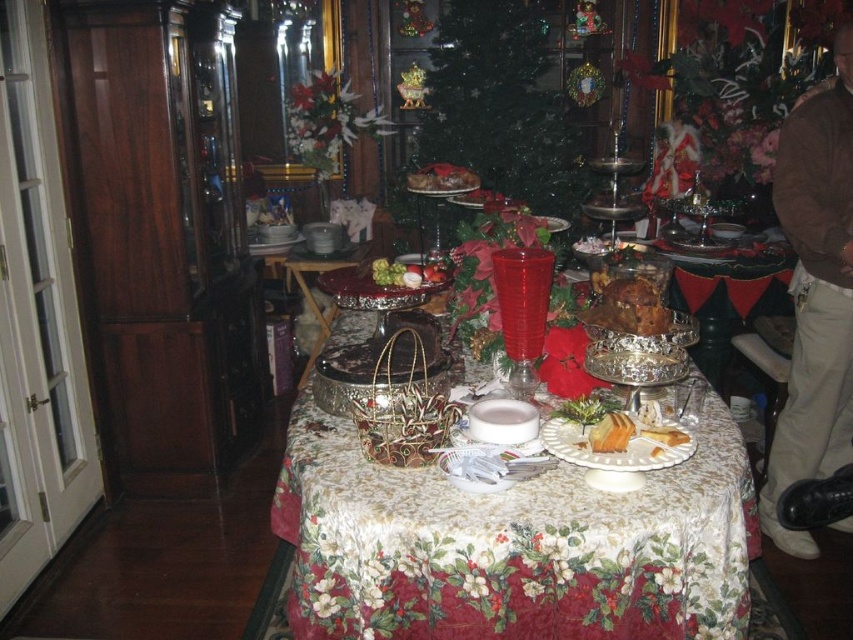
Can you confirm if shiny silver cake stand at center is bigger than golden brown cake at center?

Yes.

Based on the photo, does shiny silver cake stand at center appear over golden brown cake at center?

Incorrect, shiny silver cake stand at center is not positioned above golden brown cake at center.

Between point (496, 484) and point (611, 308), which one is positioned in front?

Point (496, 484) is in front.

You are a GUI agent. You are given a task and a screenshot of the screen. Output one action in this format:
    pyautogui.click(x=<x>, y=<y>)
    Task: Click on the shiny silver cake stand at center
    
    Given the screenshot: What is the action you would take?
    [x=553, y=353]

Does floral-patterned fabric at center have a lesser height compared to golden cake at center?

No.

Who is positioned more to the left, floral-patterned fabric at center or golden cake at center?

From the viewer's perspective, floral-patterned fabric at center appears more on the left side.

Does point (409, 596) lie in front of point (653, 428)?

Yes, point (409, 596) is in front of point (653, 428).

This screenshot has height=640, width=853. I want to click on floral-patterned fabric at center, so click(514, 545).

Which is more to the right, golden cake at center or matte silver cake at center?

golden cake at center

Which is behind, point (614, 426) or point (434, 176)?

The point (434, 176) is behind.

Where is `golden cake at center`? The image size is (853, 640). golden cake at center is located at coordinates (619, 440).